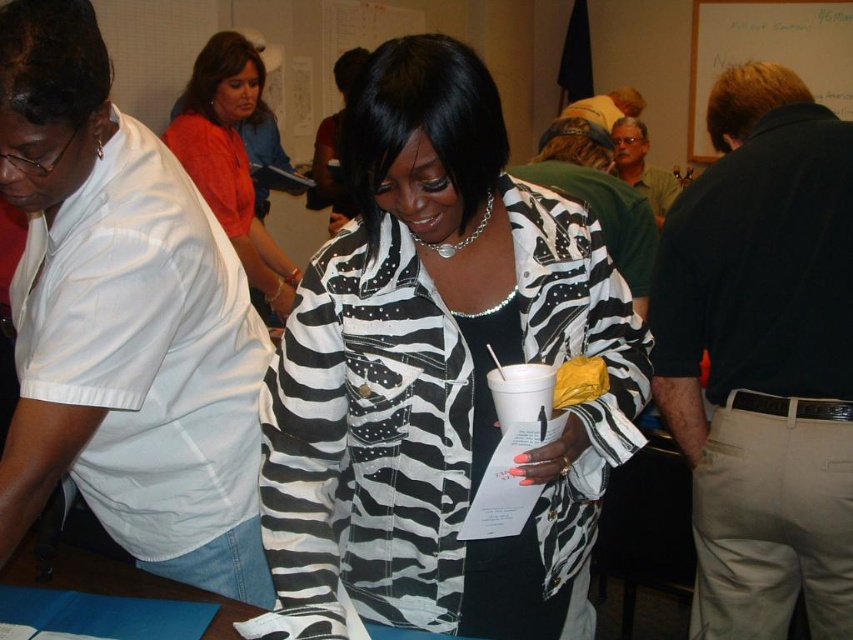
Does zebra print jacket at center have a lesser height compared to green textured shirt at upper right?

Incorrect, zebra print jacket at center's height does not fall short of green textured shirt at upper right's.

Who is taller, zebra print jacket at center or green textured shirt at upper right?

zebra print jacket at center is taller.

Where is `zebra print jacket at center`? zebra print jacket at center is located at coordinates point(334,145).

Is point (125, 134) positioned behind point (341, 56)?

No, (125, 134) is in front of (341, 56).

Locate an element on the screen. The image size is (853, 640). white shirt at left is located at coordinates (123, 321).

Which is below, white shirt at left or dark brown cotton polo shirt at upper right?

dark brown cotton polo shirt at upper right is lower down.

Is white shirt at left to the left of dark brown cotton polo shirt at upper right from the viewer's perspective?

Indeed, white shirt at left is positioned on the left side of dark brown cotton polo shirt at upper right.

Between point (173, 184) and point (769, 336), which one is positioned behind?

The point (769, 336) is more distant.

The image size is (853, 640). What are the coordinates of `white shirt at left` in the screenshot? It's located at (123, 321).